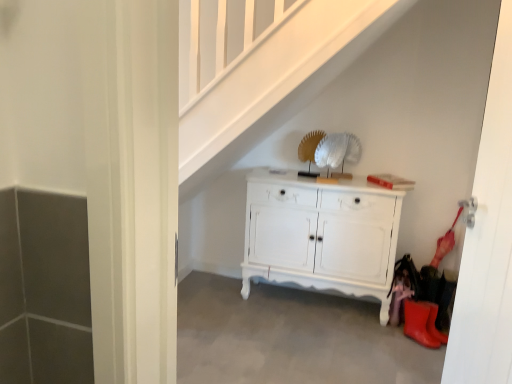
Question: Is white glossy door at right bigger or smaller than white painted wood cabinet at center?

Choices:
 (A) big
 (B) small

Answer: (B)

Question: In the image, is white glossy door at right positioned in front of or behind white painted wood cabinet at center?

Choices:
 (A) front
 (B) behind

Answer: (A)

Question: Which object is the closest to the white painted wood cabinet at center?

Choices:
 (A) white glossy door at right
 (B) gray concrete at lower center
 (C) rubber/matte boot at lower right

Answer: (B)

Question: Considering the real-world distances, which object is closest to the rubber/matte boot at lower right?

Choices:
 (A) gray concrete at lower center
 (B) white painted wood cabinet at center
 (C) white glossy door at right

Answer: (B)